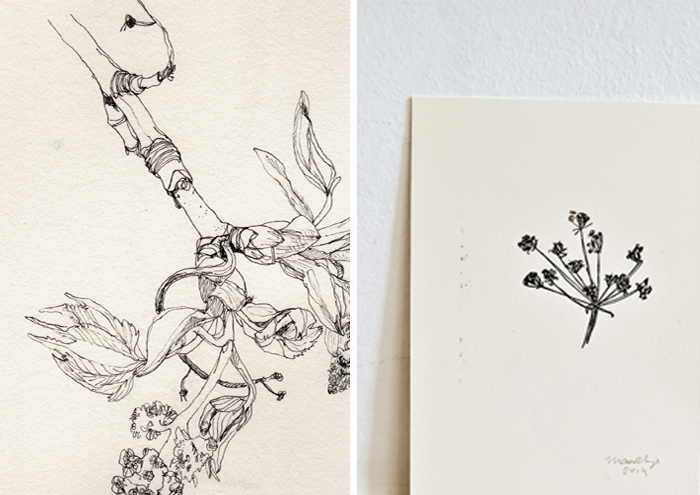
Locate an element on the screen. bouquet is located at coordinates (595, 304).